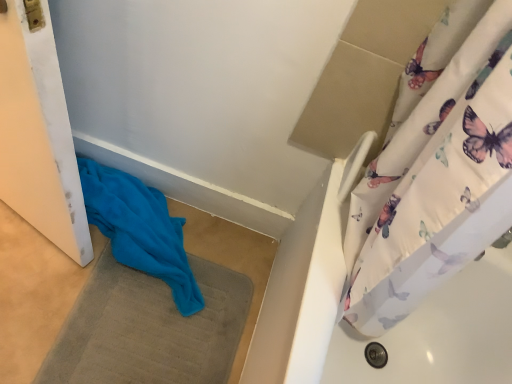
What do you see at coordinates (149, 328) in the screenshot?
I see `blue fabric bath mat at lower left` at bounding box center [149, 328].

Where is `blue fabric bath mat at lower left`? Image resolution: width=512 pixels, height=384 pixels. blue fabric bath mat at lower left is located at coordinates (149, 328).

Locate an element on the screen. blue soft towel at lower left is located at coordinates (140, 229).

This screenshot has width=512, height=384. What do you see at coordinates (140, 229) in the screenshot?
I see `blue soft towel at lower left` at bounding box center [140, 229].

In order to click on blue fabric bath mat at lower left in this screenshot , I will do `click(149, 328)`.

Is blue soft towel at lower left at the left side of blue fabric bath mat at lower left?

Yes, blue soft towel at lower left is to the left of blue fabric bath mat at lower left.

Is blue soft towel at lower left positioned before blue fabric bath mat at lower left?

No, it is not.

Considering the positions of point (146, 193) and point (95, 283), is point (146, 193) closer or farther from the camera than point (95, 283)?

Point (146, 193).

From the image's perspective, which object appears higher, blue soft towel at lower left or blue fabric bath mat at lower left?

blue soft towel at lower left, from the image's perspective.

From a real-world perspective, is blue soft towel at lower left positioned above or below blue fabric bath mat at lower left?

From a real-world perspective, blue soft towel at lower left is physically above blue fabric bath mat at lower left.

Is blue soft towel at lower left thinner than blue fabric bath mat at lower left?

Indeed, blue soft towel at lower left has a lesser width compared to blue fabric bath mat at lower left.

Considering the relative sizes of blue soft towel at lower left and blue fabric bath mat at lower left in the image provided, is blue soft towel at lower left shorter than blue fabric bath mat at lower left?

In fact, blue soft towel at lower left may be taller than blue fabric bath mat at lower left.

Is blue soft towel at lower left bigger than blue fabric bath mat at lower left?

Yes.

Is blue soft towel at lower left positioned beyond the bounds of blue fabric bath mat at lower left?

blue soft towel at lower left is positioned outside blue fabric bath mat at lower left.

From the picture: Are blue soft towel at lower left and blue fabric bath mat at lower left located far from each other?

blue soft towel at lower left is near blue fabric bath mat at lower left, not far away.

Is blue soft towel at lower left positioned with its back to blue fabric bath mat at lower left?

No, blue soft towel at lower left is not facing the opposite direction of blue fabric bath mat at lower left.

The height and width of the screenshot is (384, 512). Find the location of `fabric on the left of the blue fabric bath mat at lower left`. fabric on the left of the blue fabric bath mat at lower left is located at coordinates (140, 229).

Can you confirm if blue fabric bath mat at lower left is positioned to the right of blue soft towel at lower left?

Correct, you'll find blue fabric bath mat at lower left to the right of blue soft towel at lower left.

Relative to blue soft towel at lower left, is blue fabric bath mat at lower left in front or behind?

Visually, blue fabric bath mat at lower left is located in front of blue soft towel at lower left.

Which is less distant, (89,279) or (139,236)?

Clearly, point (89,279) is more distant from the camera than point (139,236).

Based on the photo, from the image's perspective, which is below, blue fabric bath mat at lower left or blue soft towel at lower left?

From the image's view, blue fabric bath mat at lower left is below.

From a real-world perspective, is blue fabric bath mat at lower left physically above blue soft towel at lower left?

No.

Considering the sizes of objects blue fabric bath mat at lower left and blue soft towel at lower left in the image provided, who is thinner, blue fabric bath mat at lower left or blue soft towel at lower left?

blue soft towel at lower left is thinner.

In terms of height, does blue fabric bath mat at lower left look taller or shorter compared to blue soft towel at lower left?

Considering their sizes, blue fabric bath mat at lower left has less height than blue soft towel at lower left.

Looking at this image, between blue fabric bath mat at lower left and blue soft towel at lower left, which one has smaller size?

Smaller between the two is blue fabric bath mat at lower left.

Could blue soft towel at lower left be considered to be inside blue fabric bath mat at lower left?

No, blue soft towel at lower left is not a part of blue fabric bath mat at lower left.

Does blue fabric bath mat at lower left touch blue soft towel at lower left?

No, blue fabric bath mat at lower left is not beside blue soft towel at lower left.

Is blue fabric bath mat at lower left oriented towards blue soft towel at lower left?

No, blue fabric bath mat at lower left is not turned towards blue soft towel at lower left.

Image resolution: width=512 pixels, height=384 pixels. I want to click on bath mat on the right side of blue soft towel at lower left, so click(149, 328).

At what (x,y) coordinates should I click in order to perform the action: click on bath mat that appears on the right of blue soft towel at lower left. Please return your answer as a coordinate pair (x, y). The width and height of the screenshot is (512, 384). Looking at the image, I should click on click(149, 328).

Image resolution: width=512 pixels, height=384 pixels. I want to click on bath mat in front of the blue soft towel at lower left, so click(149, 328).